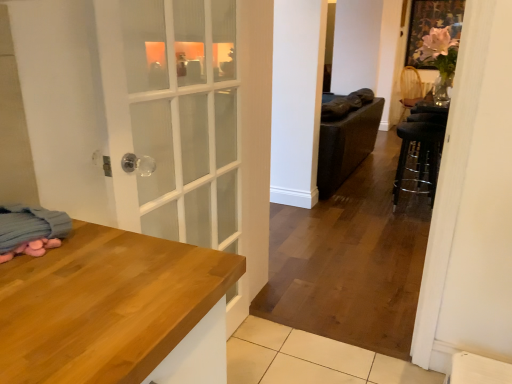
Locate an element on the screen. free spot behind black metal bar stool at right is located at coordinates (377, 197).